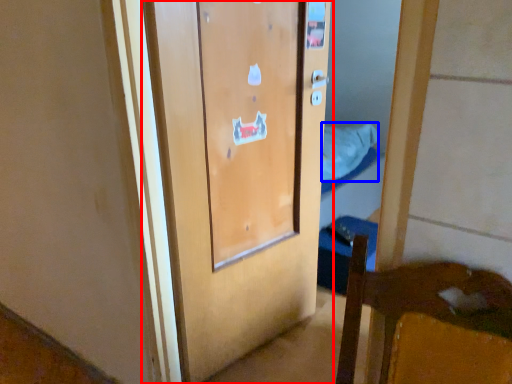
Question: Which object is closer to the camera taking this photo, door (highlighted by a red box) or sheet (highlighted by a blue box)?

Choices:
 (A) door
 (B) sheet

Answer: (A)